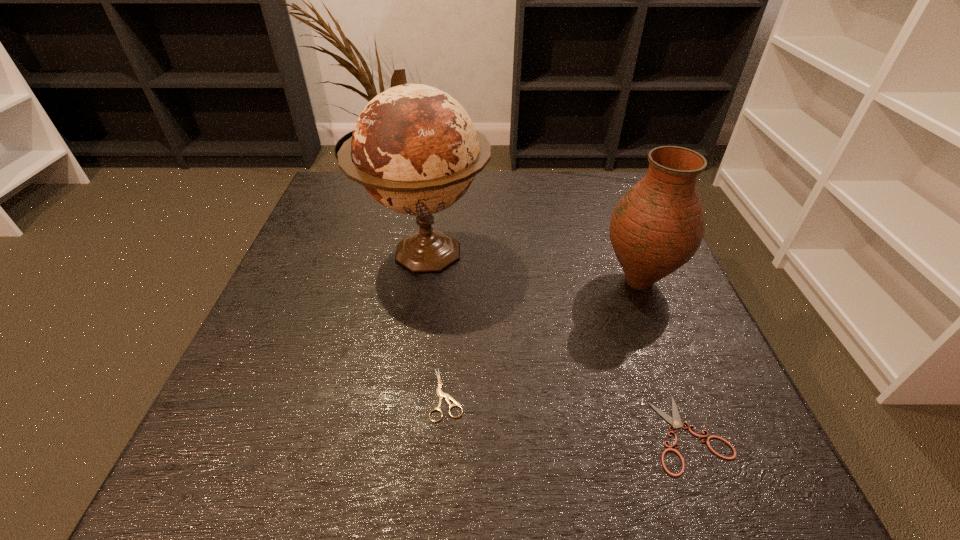
The width and height of the screenshot is (960, 540). What are the coordinates of `free space that is in between the tallest object and the right shears` in the screenshot? It's located at (558, 343).

Where is `vacant point located between the vase and the left shears`? The height and width of the screenshot is (540, 960). vacant point located between the vase and the left shears is located at coordinates (543, 338).

Identify the location of free point between the right shears and the third shortest object. This screenshot has height=540, width=960. (664, 357).

The height and width of the screenshot is (540, 960). What are the coordinates of `vacant area that lies between the right shears and the second tallest object` in the screenshot? It's located at (664, 357).

Locate an element on the screen. free space between the right shears and the left shears is located at coordinates (568, 414).

Locate an element on the screen. free spot between the third shortest object and the tallest object is located at coordinates (533, 267).

I want to click on vacant space that is in between the globe and the third shortest object, so click(x=533, y=267).

You are a GUI agent. You are given a task and a screenshot of the screen. Output one action in this format:
    pyautogui.click(x=<x>, y=<y>)
    Task: Click on the empty space that is in between the left shears and the tallest object
    
    Given the screenshot: What is the action you would take?
    pyautogui.click(x=437, y=323)

This screenshot has width=960, height=540. Find the location of `free space that is in between the second tallest object and the globe`. free space that is in between the second tallest object and the globe is located at coordinates (533, 267).

This screenshot has width=960, height=540. I want to click on vacant space that's between the left shears and the vase, so click(543, 338).